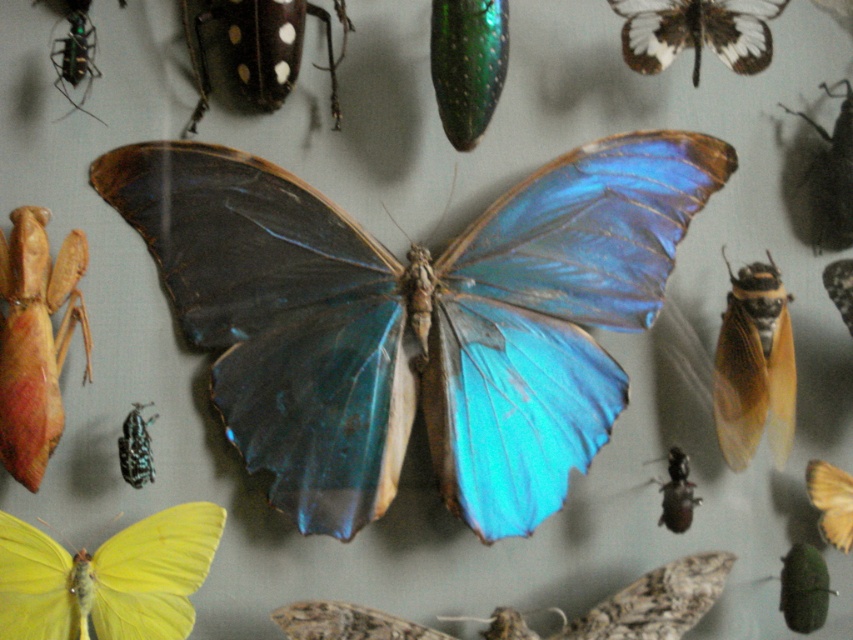
Question: Which point appears farthest from the camera in this image?

Choices:
 (A) (125, 458)
 (B) (785, 588)
 (C) (450, 4)

Answer: (B)

Question: Which of the following is the farthest from the observer?

Choices:
 (A) (839, 188)
 (B) (71, 330)

Answer: (A)

Question: Which point is farther to the camera?

Choices:
 (A) shiny metallic butterfly at center
 (B) shiny metallic beetle at upper right
 (C) shiny brown beetle at upper center

Answer: (B)

Question: Can you confirm if white translucent wings at upper right is positioned to the left of shiny metallic butterfly at center?

Choices:
 (A) no
 (B) yes

Answer: (B)

Question: Can you confirm if yellow matte wing at right is positioned above shiny metallic butterfly at center?

Choices:
 (A) yes
 (B) no

Answer: (B)

Question: Is yellow matte wing at right below shiny brown beetle at upper center?

Choices:
 (A) yes
 (B) no

Answer: (A)